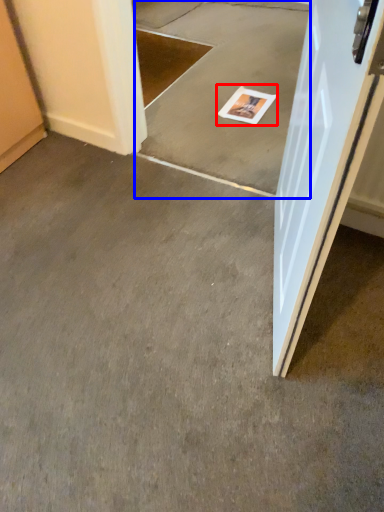
Question: Among these objects, which one is nearest to the camera, magazine (highlighted by a red box) or concrete (highlighted by a blue box)?

Choices:
 (A) magazine
 (B) concrete

Answer: (B)